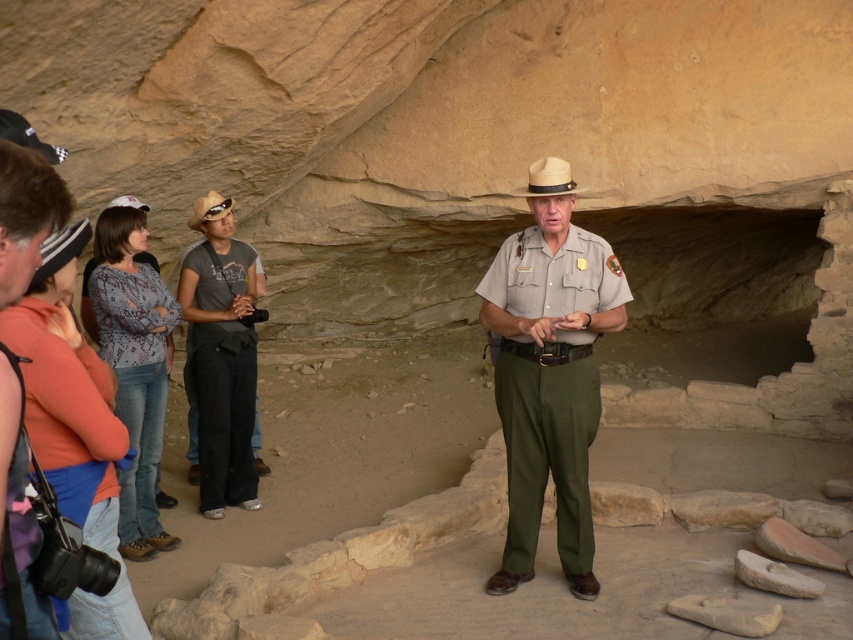
Which is in front, point (41, 272) or point (242, 337)?

Point (41, 272)

Who is shorter, orange cotton shirt at left or gray cotton shirt at center?

Standing shorter between the two is orange cotton shirt at left.

Where is `orange cotton shirt at left`? orange cotton shirt at left is located at coordinates (74, 426).

What are the coordinates of `orange cotton shirt at left` in the screenshot? It's located at (74, 426).

Does patterned fabric shirt at left have a larger size compared to light brown straw cowboy hat at center?

Yes, patterned fabric shirt at left is bigger than light brown straw cowboy hat at center.

Between patterned fabric shirt at left and light brown straw cowboy hat at center, which one has less height?

light brown straw cowboy hat at center

Who is more distant from viewer, (103, 275) or (561, 176)?

Positioned behind is point (103, 275).

The image size is (853, 640). Identify the location of patterned fabric shirt at left. (134, 365).

Does khaki uniform at center have a greater height compared to orange cotton shirt at left?

Yes, khaki uniform at center is taller than orange cotton shirt at left.

Who is positioned more to the right, khaki uniform at center or orange cotton shirt at left?

khaki uniform at center is more to the right.

Between point (532, 557) and point (41, 413), which one is positioned behind?

The point (532, 557) is more distant.

Identify the location of khaki uniform at center. The image size is (853, 640). (549, 371).